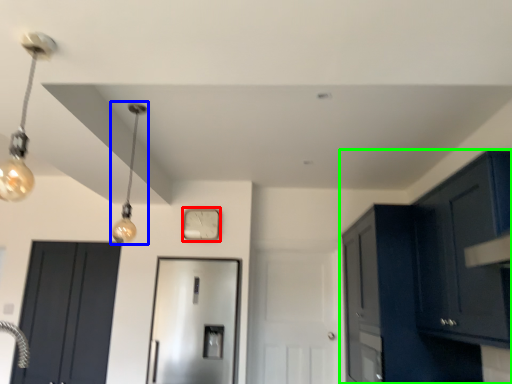
Question: Which is farther away from clock (highlighted by a red box)? light (highlighted by a blue box) or cabinetry (highlighted by a green box)?

Choices:
 (A) light
 (B) cabinetry

Answer: (B)